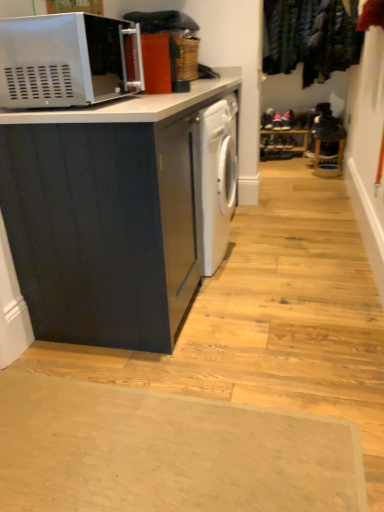
Question: Is matte black cabinet at left taller than velvet green coat at upper right?

Choices:
 (A) no
 (B) yes

Answer: (B)

Question: From the image's perspective, does matte black cabinet at left appear lower than velvet green coat at upper right?

Choices:
 (A) no
 (B) yes

Answer: (B)

Question: Is matte black cabinet at left facing away from velvet green coat at upper right?

Choices:
 (A) no
 (B) yes

Answer: (A)

Question: Is matte black cabinet at left outside velvet green coat at upper right?

Choices:
 (A) no
 (B) yes

Answer: (B)

Question: Considering the relative positions of matte black cabinet at left and velvet green coat at upper right in the image provided, is matte black cabinet at left to the left of velvet green coat at upper right from the viewer's perspective?

Choices:
 (A) yes
 (B) no

Answer: (A)

Question: Is matte black cabinet at left closer to the viewer compared to velvet green coat at upper right?

Choices:
 (A) no
 (B) yes

Answer: (B)

Question: Is satin silver microwave at upper left not inside beige rubber doormat at lower center?

Choices:
 (A) no
 (B) yes

Answer: (B)

Question: Does satin silver microwave at upper left have a smaller size compared to beige rubber doormat at lower center?

Choices:
 (A) yes
 (B) no

Answer: (B)

Question: Is satin silver microwave at upper left surrounding beige rubber doormat at lower center?

Choices:
 (A) yes
 (B) no

Answer: (B)

Question: Is satin silver microwave at upper left to the left of beige rubber doormat at lower center from the viewer's perspective?

Choices:
 (A) no
 (B) yes

Answer: (B)

Question: Does satin silver microwave at upper left have a lesser width compared to beige rubber doormat at lower center?

Choices:
 (A) yes
 (B) no

Answer: (A)

Question: Can you confirm if satin silver microwave at upper left is bigger than beige rubber doormat at lower center?

Choices:
 (A) yes
 (B) no

Answer: (A)

Question: Does matte black cabinet at left lie behind beige rubber doormat at lower center?

Choices:
 (A) no
 (B) yes

Answer: (B)